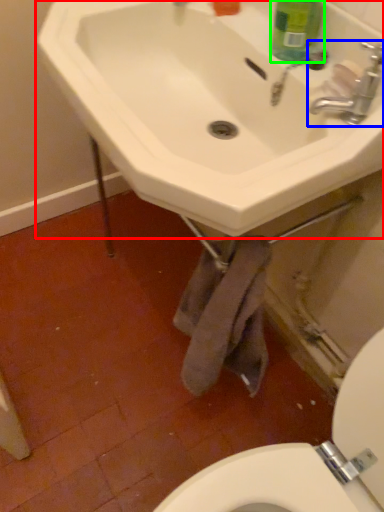
Question: Which is nearer to the sink (highlighted by a red box)? tap (highlighted by a blue box) or cleaning product (highlighted by a green box).

Choices:
 (A) tap
 (B) cleaning product

Answer: (B)